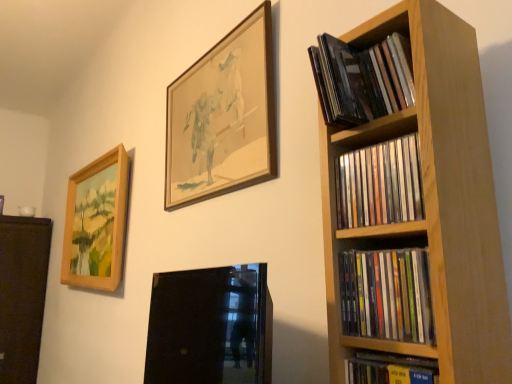
Question: From the image's perspective, is matte black cds at upper right, which is the fourth book in bottom-to-top order, below hardcover book at lower right, marked as the first book in a bottom-to-top arrangement?

Choices:
 (A) no
 (B) yes

Answer: (A)

Question: Is matte black cds at upper right, which is the fourth book in bottom-to-top order, thinner than hardcover book at lower right, the fourth book when ordered from top to bottom?

Choices:
 (A) yes
 (B) no

Answer: (B)

Question: Can you see matte black cds at upper right, arranged as the first book when viewed from the top, touching hardcover book at lower right, the fourth book when ordered from top to bottom?

Choices:
 (A) no
 (B) yes

Answer: (A)

Question: Is matte black cds at upper right, which is the fourth book in bottom-to-top order, turned away from hardcover book at lower right, marked as the first book in a bottom-to-top arrangement?

Choices:
 (A) no
 (B) yes

Answer: (A)

Question: Is matte black cds at upper right, arranged as the first book when viewed from the top, smaller than hardcover book at lower right, the fourth book when ordered from top to bottom?

Choices:
 (A) no
 (B) yes

Answer: (B)

Question: From the image's perspective, relative to black glass picture frame at lower center, the 2th picture frame in the right-to-left sequence, is matte plastic cds at right, the second book ordered from the bottom, above or below?

Choices:
 (A) below
 (B) above

Answer: (B)

Question: Considering their positions, is matte plastic cds at right, the second book ordered from the bottom, located in front of or behind black glass picture frame at lower center, the 2th picture frame in the right-to-left sequence?

Choices:
 (A) behind
 (B) front

Answer: (A)

Question: Does point (354, 292) appear closer or farther from the camera than point (258, 349)?

Choices:
 (A) closer
 (B) farther

Answer: (A)

Question: Considering the positions of matte plastic cds at right, arranged as the 3th book when viewed from the top, and black glass picture frame at lower center, the first picture frame in the front-to-back sequence, in the image, is matte plastic cds at right, arranged as the 3th book when viewed from the top, wider or thinner than black glass picture frame at lower center, the first picture frame in the front-to-back sequence,?

Choices:
 (A) wide
 (B) thin

Answer: (B)

Question: In terms of size, does matte plastic cds at right, the second book ordered from the bottom, appear bigger or smaller than wooden-framed painting at left, arranged as the first picture frame when viewed from the back?

Choices:
 (A) big
 (B) small

Answer: (B)

Question: Is matte plastic cds at right, arranged as the 3th book when viewed from the top, wider or thinner than wooden-framed painting at left, marked as the third picture frame in a right-to-left arrangement?

Choices:
 (A) thin
 (B) wide

Answer: (A)

Question: Is matte plastic cds at right, the second book ordered from the bottom, to the left or to the right of wooden-framed painting at left, arranged as the first picture frame when viewed from the back, in the image?

Choices:
 (A) right
 (B) left

Answer: (A)

Question: In terms of height, does matte plastic cds at right, the second book ordered from the bottom, look taller or shorter compared to wooden-framed painting at left, arranged as the first picture frame when viewed from the back?

Choices:
 (A) short
 (B) tall

Answer: (A)

Question: Would you say wooden picture frame at upper center, the first picture frame when ordered from right to left, is to the left or to the right of black glass picture frame at lower center, which is the second picture frame in left-to-right order, in the picture?

Choices:
 (A) right
 (B) left

Answer: (A)

Question: Which is correct: wooden picture frame at upper center, the first picture frame when ordered from right to left, is inside black glass picture frame at lower center, the first picture frame in the front-to-back sequence, or outside of it?

Choices:
 (A) inside
 (B) outside

Answer: (B)